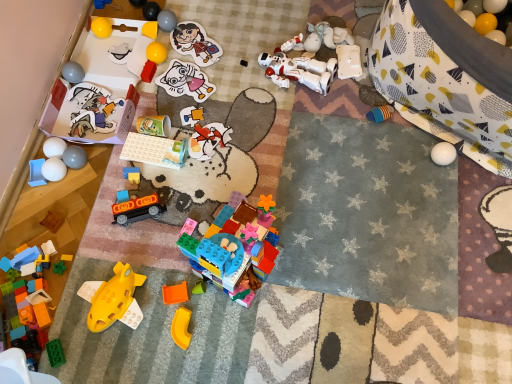
Question: From a real-world perspective, is white plastic remote control at upper center, the 24th toy when ordered from left to right, physically below matte paper sticker at center, the seventh toy viewed from the right?

Choices:
 (A) no
 (B) yes

Answer: (A)

Question: Is white plastic remote control at upper center, the 24th toy when ordered from left to right, far away from matte paper sticker at center, the nineteenth toy when ordered from left to right?

Choices:
 (A) no
 (B) yes

Answer: (A)

Question: Considering the relative sizes of white plastic remote control at upper center, the 24th toy when ordered from left to right, and matte paper sticker at center, the nineteenth toy when ordered from left to right, in the image provided, is white plastic remote control at upper center, the 24th toy when ordered from left to right, taller than matte paper sticker at center, the nineteenth toy when ordered from left to right,?

Choices:
 (A) no
 (B) yes

Answer: (B)

Question: Is white plastic remote control at upper center, which is the second toy from right to left, facing towards matte paper sticker at center, the nineteenth toy when ordered from left to right?

Choices:
 (A) no
 (B) yes

Answer: (B)

Question: From the image's perspective, would you say white plastic remote control at upper center, which is the second toy from right to left, is positioned over matte paper sticker at center, the nineteenth toy when ordered from left to right?

Choices:
 (A) no
 (B) yes

Answer: (B)

Question: From the image's perspective, is white plastic remote control at upper center, the 24th toy when ordered from left to right, under matte paper sticker at center, the nineteenth toy when ordered from left to right?

Choices:
 (A) yes
 (B) no

Answer: (B)

Question: From a real-world perspective, is translucent blue plastic plate at center, the ninth toy in the right-to-left sequence, physically below translucent orange plastic toy at center, the fourth toy in the right-to-left sequence?

Choices:
 (A) no
 (B) yes

Answer: (A)

Question: Can we say translucent blue plastic plate at center, the seventeenth toy viewed from the left, lies outside translucent orange plastic toy at center, placed as the 22th toy when sorted from left to right?

Choices:
 (A) no
 (B) yes

Answer: (B)

Question: Could you tell me if translucent blue plastic plate at center, the seventeenth toy viewed from the left, is turned towards translucent orange plastic toy at center, placed as the 22th toy when sorted from left to right?

Choices:
 (A) yes
 (B) no

Answer: (B)

Question: Considering the relative positions of translucent blue plastic plate at center, the ninth toy in the right-to-left sequence, and translucent orange plastic toy at center, placed as the 22th toy when sorted from left to right, in the image provided, is translucent blue plastic plate at center, the ninth toy in the right-to-left sequence, to the left of translucent orange plastic toy at center, placed as the 22th toy when sorted from left to right, from the viewer's perspective?

Choices:
 (A) no
 (B) yes

Answer: (B)

Question: From the image's perspective, does translucent blue plastic plate at center, the seventeenth toy viewed from the left, appear lower than translucent orange plastic toy at center, the fourth toy in the right-to-left sequence?

Choices:
 (A) no
 (B) yes

Answer: (A)

Question: Is translucent blue plastic plate at center, the seventeenth toy viewed from the left, positioned in front of translucent orange plastic toy at center, placed as the 22th toy when sorted from left to right?

Choices:
 (A) no
 (B) yes

Answer: (A)

Question: From a real-world perspective, is white matte eggs at left, the third toy from the left, over rubber yellow ball at upper left, positioned as the tenth toy in left-to-right order?

Choices:
 (A) yes
 (B) no

Answer: (B)